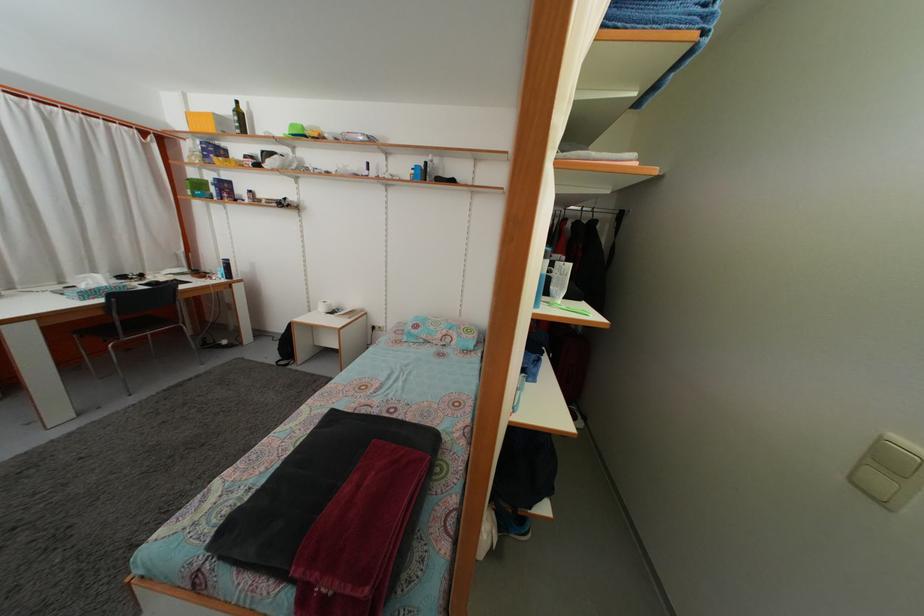
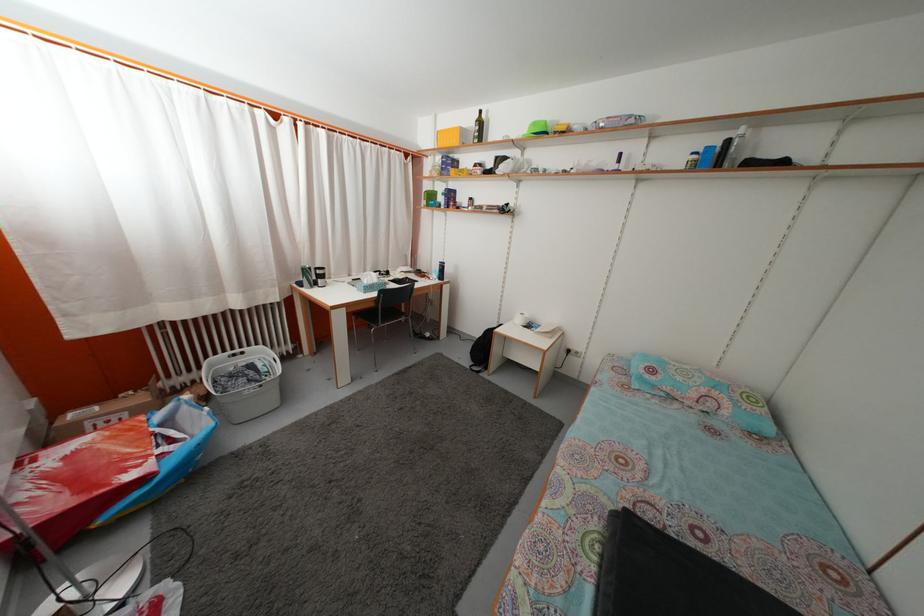
Find the pixel in the second image that matches point (225, 127) in the first image.

(468, 139)